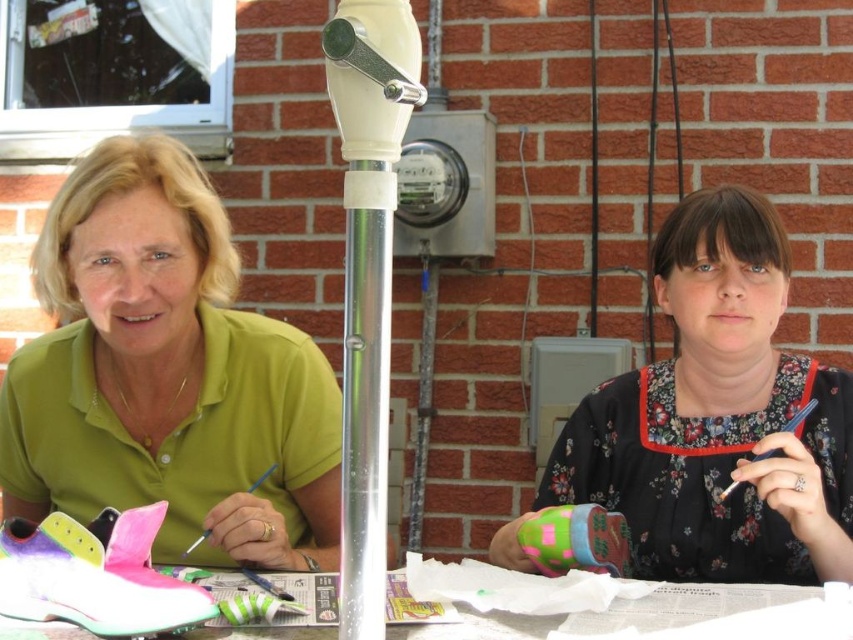
You are a tailor who needs to determine which garment has a greater width for a client who prefers wider clothing. Based on the image, which one between the green matte shirt at center and the floral fabric dress at center is wider?

The green matte shirt at center is wider than the floral fabric dress at center according to the description.

You are an artist working on a craft project. You need to place a new decorative sticker on the white paper at center without covering the floral fabric dress at center. Is this possible?

The floral fabric dress at center is located above the white paper at center, so placing a sticker on the white paper at center would require placing it underneath the dress, which is not possible without covering the dress. Therefore, it is not possible to place the sticker on the white paper at center without covering the floral fabric dress at center.